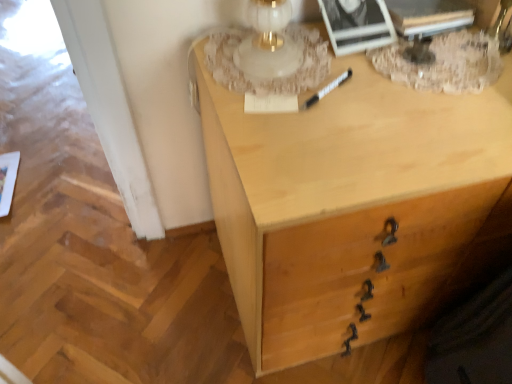
Find the location of a particular element. vacant region above light wood chest of drawers at center (from a real-world perspective) is located at coordinates (398, 81).